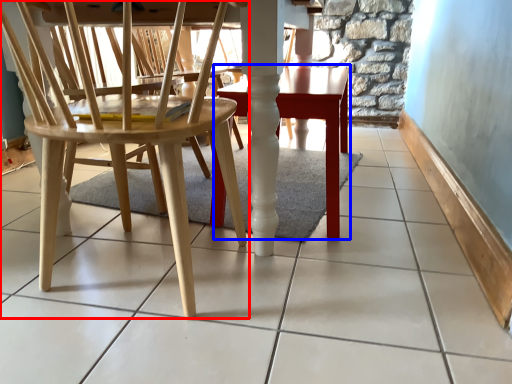
Question: Which of the following is the farthest to the observer, chair (highlighted by a red box) or table (highlighted by a blue box)?

Choices:
 (A) chair
 (B) table

Answer: (B)